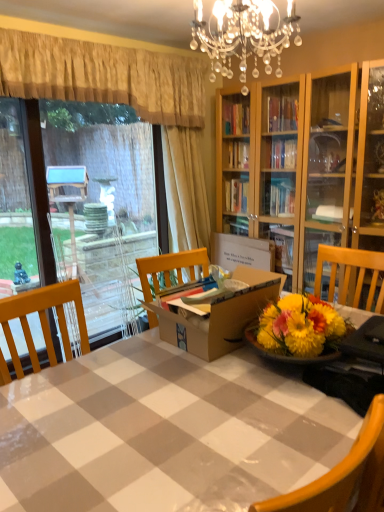
Question: From a real-world perspective, is brown cardboard box at center above or below yellow textured curtain at upper left, arranged as the 2th curtain when viewed from the right?

Choices:
 (A) below
 (B) above

Answer: (A)

Question: Considering the positions of brown cardboard box at center and yellow textured curtain at upper left, arranged as the 2th curtain when viewed from the right, in the image, is brown cardboard box at center taller or shorter than yellow textured curtain at upper left, arranged as the 2th curtain when viewed from the right,?

Choices:
 (A) tall
 (B) short

Answer: (B)

Question: Which is nearer to the wooden chair at lower right?

Choices:
 (A) beige fabric curtain at upper left, the 2th curtain when ordered from left to right
 (B) transparent glass door at left
 (C) yellow textured curtain at upper left, the 1th curtain viewed from the left
 (D) brown cardboard box at center
 (E) white glossy table at center

Answer: (E)

Question: Estimate the real-world distances between objects in this image. Which object is closer to the beige fabric curtain at upper left, which ranks as the 1th curtain in right-to-left order?

Choices:
 (A) wooden chair at lower right
 (B) brown cardboard box at center
 (C) transparent glass door at left
 (D) yellow textured curtain at upper left, the 1th curtain viewed from the left
 (E) cardboard box at center

Answer: (E)